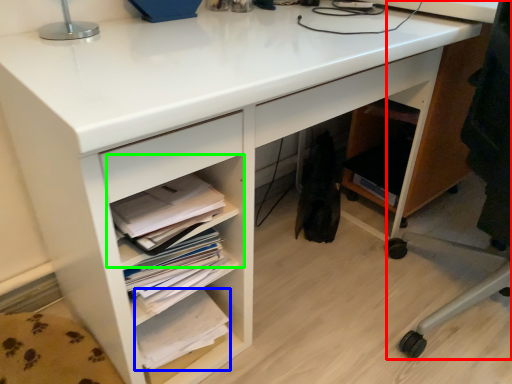
Question: Based on their relative distances, which object is farther from computer chair (highlighted by a red box)? Choose from book (highlighted by a blue box) and shelf (highlighted by a green box).

Choices:
 (A) book
 (B) shelf

Answer: (A)